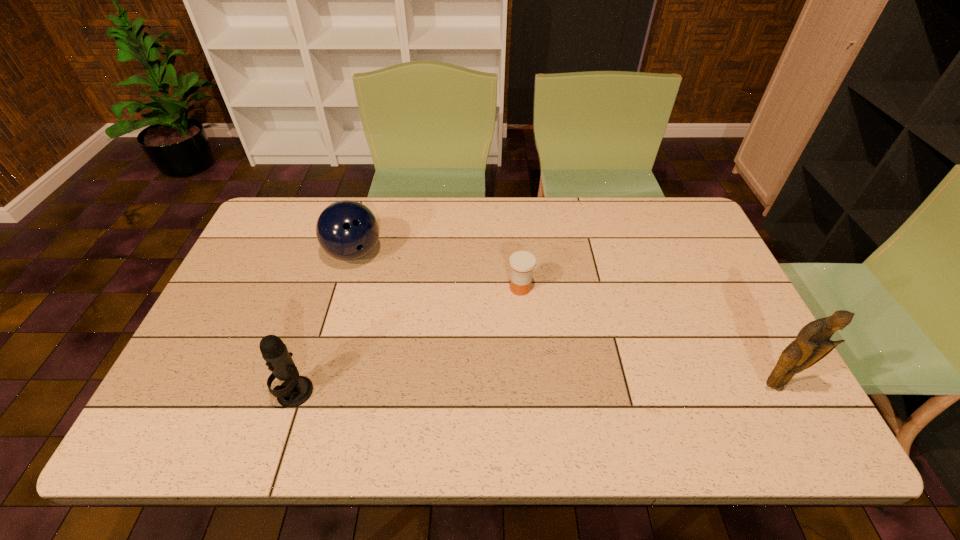
Image resolution: width=960 pixels, height=540 pixels. Identify the location of free space on the desktop that is between the microphone and the figurine and is positioned on the surface of the farthest object near the finger holes. (566, 389).

Where is `vacant spot on the desktop that is between the microphone and the figurine and is positioned on the label of the shortest object`? This screenshot has width=960, height=540. vacant spot on the desktop that is between the microphone and the figurine and is positioned on the label of the shortest object is located at coordinates (550, 389).